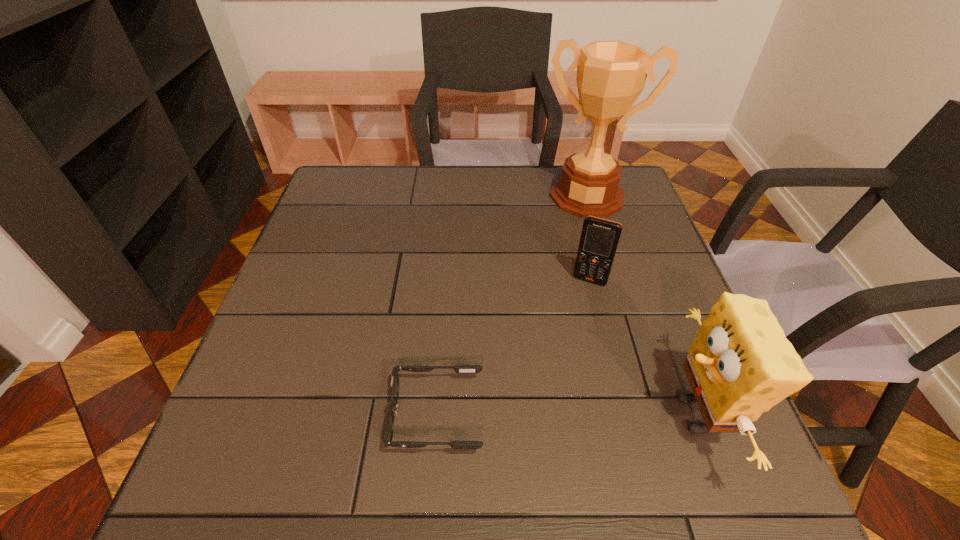
Where is `vacant region at the far left corner of the desktop`? The width and height of the screenshot is (960, 540). vacant region at the far left corner of the desktop is located at coordinates (362, 164).

The width and height of the screenshot is (960, 540). I want to click on free space at the near left corner of the desktop, so click(261, 438).

Locate an element on the screen. free space at the near right corner of the desktop is located at coordinates (715, 434).

Find the location of a particular element. This screenshot has width=960, height=540. vacant space in between the farthest object and the third shortest object is located at coordinates (641, 305).

Locate an element on the screen. This screenshot has width=960, height=540. vacant region between the third shortest object and the tallest object is located at coordinates pos(641,305).

At what (x,y) coordinates should I click in order to perform the action: click on free space between the sunglasses and the sponge. Please return your answer as a coordinate pair (x, y). Image resolution: width=960 pixels, height=540 pixels. Looking at the image, I should click on (566, 415).

Where is `empty location between the second tallest object and the leftmost object`? empty location between the second tallest object and the leftmost object is located at coordinates (566, 415).

Locate an element on the screen. Image resolution: width=960 pixels, height=540 pixels. vacant region between the farthest object and the sunglasses is located at coordinates (512, 306).

You are a GUI agent. You are given a task and a screenshot of the screen. Output one action in this format:
    pyautogui.click(x=<x>, y=<y>)
    Task: Click on the free space between the third nearest object and the sponge
    The height and width of the screenshot is (540, 960).
    Given the screenshot: What is the action you would take?
    pyautogui.click(x=642, y=347)

You are a GUI agent. You are given a task and a screenshot of the screen. Output one action in this format:
    pyautogui.click(x=<x>, y=<y>)
    Task: Click on the unoccupied position between the second farthest object and the third shortest object
    The height and width of the screenshot is (540, 960).
    Given the screenshot: What is the action you would take?
    pyautogui.click(x=642, y=347)